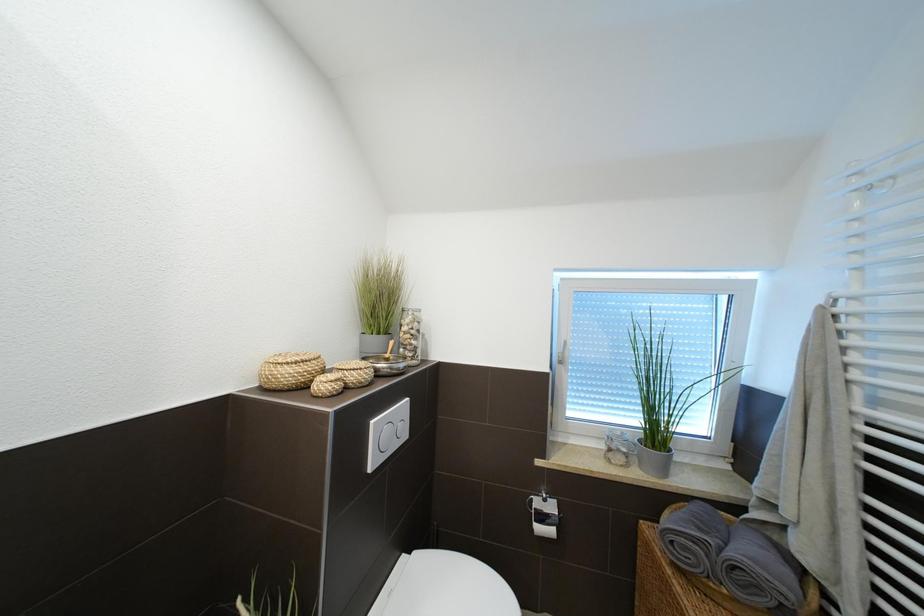
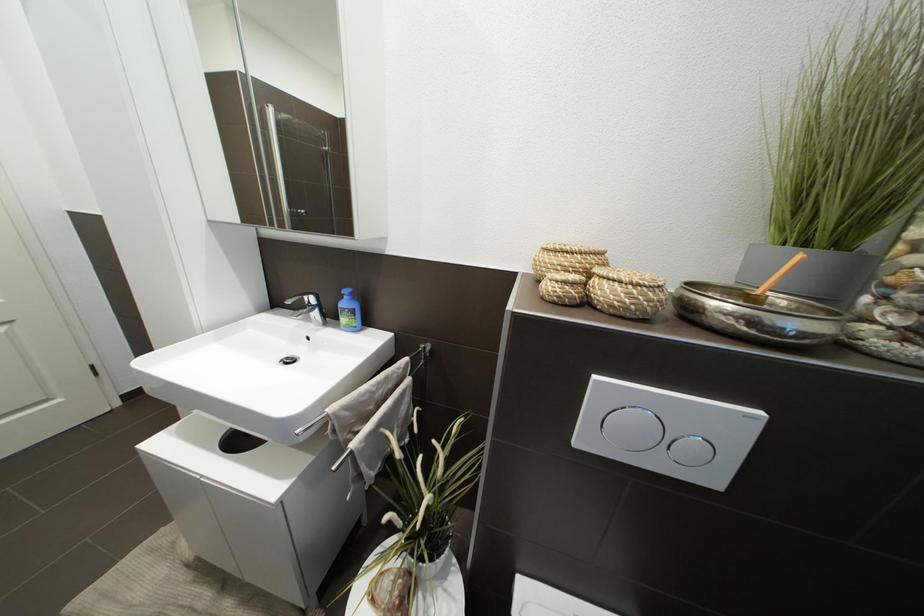
Based on the continuous images, in which direction is the camera rotating?

The rotation direction of the camera is left-down.